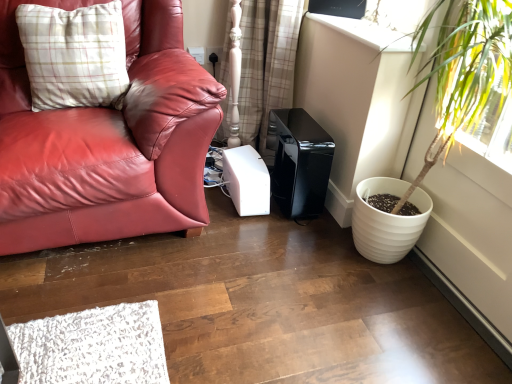
At what (x,y) coordinates should I click in order to perform the action: click on blank space above white glossy window sill at upper right (from a real-world perspective). Please return your answer as a coordinate pair (x, y). Looking at the image, I should click on (362, 28).